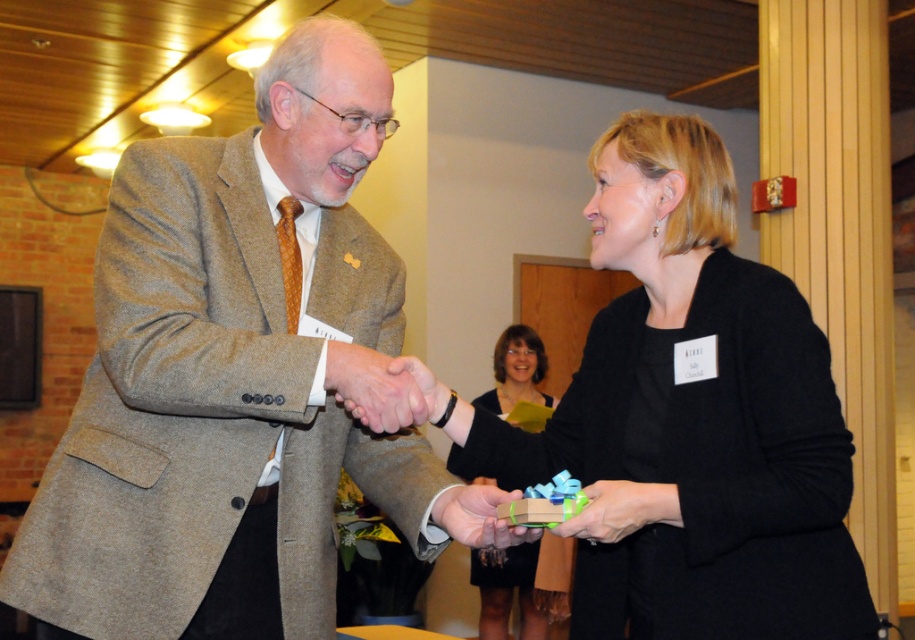
Looking at this image, does black matte jacket at center have a greater height compared to matte brown hand at center?

Correct, black matte jacket at center is much taller as matte brown hand at center.

Measure the distance between black matte jacket at center and camera.

The distance of black matte jacket at center from camera is 1.42 meters.

I want to click on black matte jacket at center, so click(690, 416).

From the picture: Which is more to the left, matte brown suit at center or matte brown hand at center?

Positioned to the left is matte brown suit at center.

Can you confirm if matte brown suit at center is smaller than matte brown hand at center?

No.

Find the location of a particular element. matte brown suit at center is located at coordinates (230, 374).

At what (x,y) coordinates should I click in order to perform the action: click on matte brown suit at center. Please return your answer as a coordinate pair (x, y). The width and height of the screenshot is (915, 640). Looking at the image, I should click on click(x=230, y=374).

Measure the distance between black matte jacket at center and matte green gift at center.

They are 10.17 inches apart.

Measure the distance between black matte jacket at center and camera.

black matte jacket at center is 4.66 feet from camera.

Find the location of a particular element. black matte jacket at center is located at coordinates (690, 416).